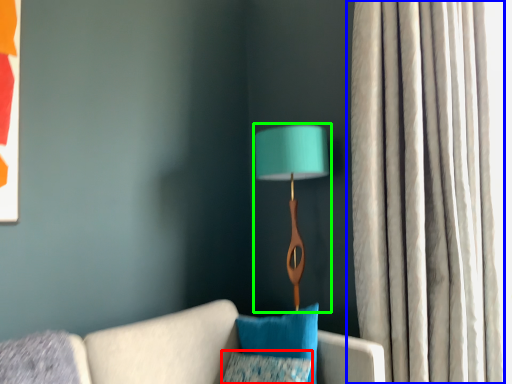
Question: Based on their relative distances, which object is nearer to pillow (highlighted by a red box)? Choose from curtain (highlighted by a blue box) and lamp (highlighted by a green box).

Choices:
 (A) curtain
 (B) lamp

Answer: (B)